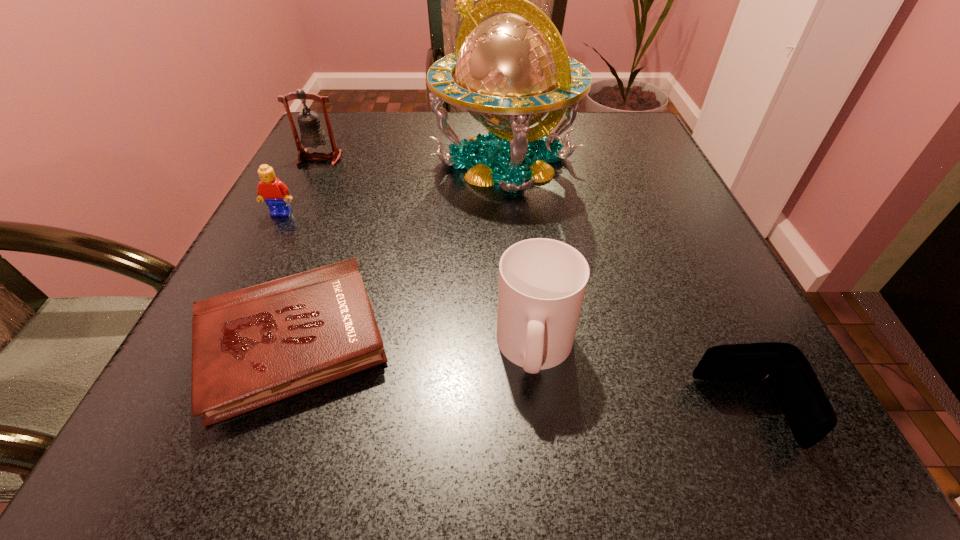
Identify the location of bell at the left edge. The width and height of the screenshot is (960, 540). (312, 134).

Locate an element on the screen. The width and height of the screenshot is (960, 540). Lego that is at the left edge is located at coordinates (275, 193).

In order to click on hardback book situated at the left edge in this screenshot , I will do `click(251, 347)`.

The image size is (960, 540). Find the location of `object that is positioned at the right edge`. object that is positioned at the right edge is located at coordinates (810, 415).

Find the location of a particular element. object at the far left corner is located at coordinates (312, 134).

Identify the location of object that is at the near left corner. (251, 347).

Where is `object present at the near right corner`? object present at the near right corner is located at coordinates (810, 415).

This screenshot has height=540, width=960. I want to click on blank space at the far edge of the desktop, so click(413, 133).

At what (x,y) coordinates should I click in order to perform the action: click on vacant region at the near edge of the desktop. Please return your answer as a coordinate pair (x, y). Image resolution: width=960 pixels, height=540 pixels. Looking at the image, I should click on (346, 423).

The width and height of the screenshot is (960, 540). In the image, there is a desktop. Find the location of `vacant space at the left edge`. vacant space at the left edge is located at coordinates (301, 182).